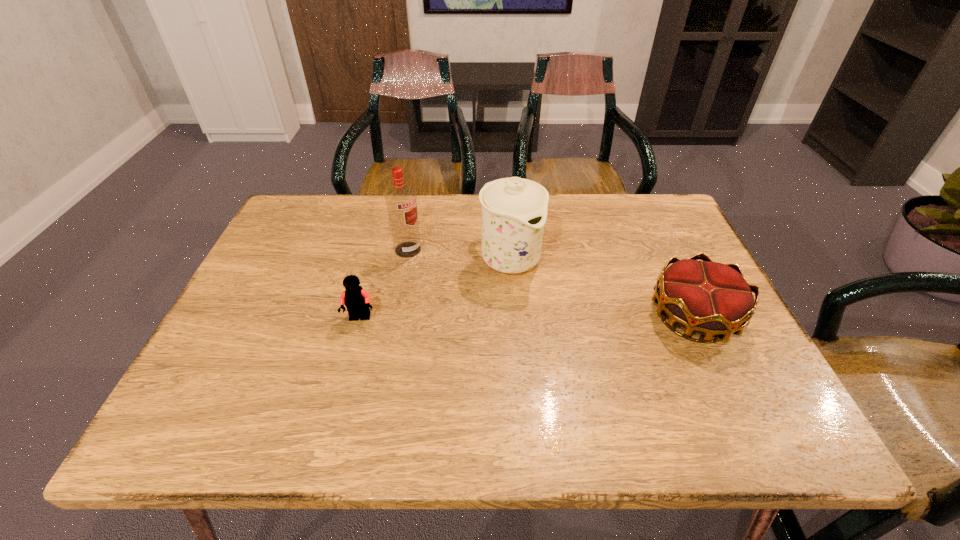
Identify the location of Lego. The height and width of the screenshot is (540, 960). (357, 301).

Identify the location of crown. (709, 298).

Identify the location of the second object from left to right. The height and width of the screenshot is (540, 960). (401, 202).

Locate an element on the screen. chinaware is located at coordinates (514, 210).

You are a GUI agent. You are given a task and a screenshot of the screen. Output one action in this format:
    pyautogui.click(x=<x>, y=<y>)
    Task: Click on the free region located on the front-facing side of the Lego
    
    Given the screenshot: What is the action you would take?
    pyautogui.click(x=351, y=351)

Identify the location of vacant region located 0.150m on the left of the crown. The width and height of the screenshot is (960, 540). (586, 316).

Identify the location of vacant area situated 0.200m on the front label of the vodka. This screenshot has height=540, width=960. coord(475,288).

The width and height of the screenshot is (960, 540). In order to click on free location located on the front label of the vodka in this screenshot , I will do `click(500, 303)`.

Locate an element on the screen. vacant space located on the front label of the vodka is located at coordinates coord(463,281).

Where is `vacant region located 0.350m on the spout of the chinaware`? The image size is (960, 540). vacant region located 0.350m on the spout of the chinaware is located at coordinates (628, 386).